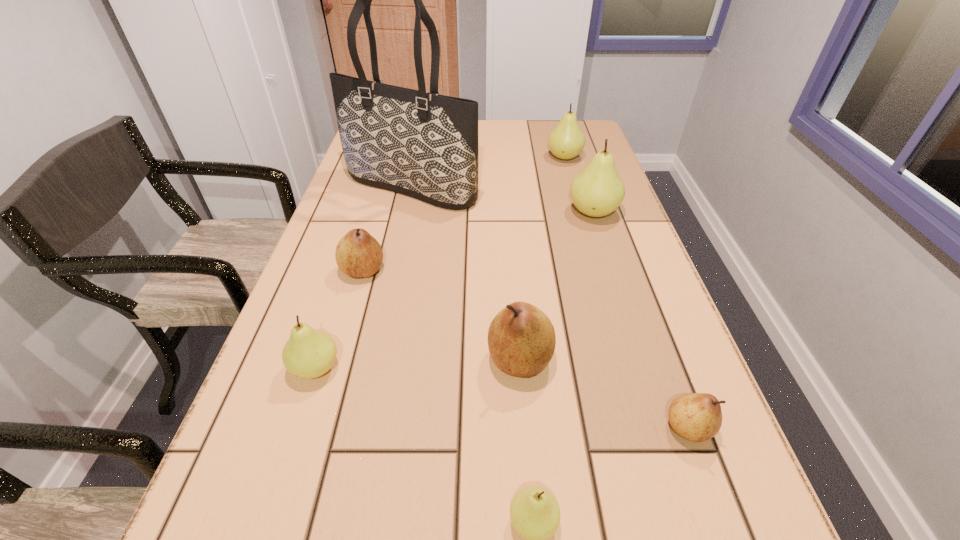
At what (x,y) coordinates should I click in order to perform the action: click on vacant region located 0.220m on the back of the sixth farthest pear. Please return your answer as a coordinate pair (x, y). Looking at the image, I should click on (645, 310).

Locate an element on the screen. The image size is (960, 540). object that is at the far edge is located at coordinates (566, 140).

At what (x,y) coordinates should I click in order to perform the action: click on tote bag that is positioned at the left edge. Please return your answer as a coordinate pair (x, y). The image size is (960, 540). Looking at the image, I should click on click(x=422, y=144).

Where is `object that is at the far right corner`? Image resolution: width=960 pixels, height=540 pixels. object that is at the far right corner is located at coordinates (566, 140).

Image resolution: width=960 pixels, height=540 pixels. What are the coordinates of `vacant space at the far edge of the desktop` in the screenshot? It's located at (485, 136).

The height and width of the screenshot is (540, 960). I want to click on vacant space at the left edge, so click(x=384, y=219).

In the image, there is a desktop. At what (x,y) coordinates should I click in order to perform the action: click on free space at the right edge. Please return your answer as a coordinate pair (x, y). The width and height of the screenshot is (960, 540). Looking at the image, I should click on tap(574, 204).

In the image, there is a desktop. Identify the location of vacant space at the far right corner. (545, 131).

Locate an element on the screen. The width and height of the screenshot is (960, 540). vacant point located between the second biggest green pear and the leftmost green pear is located at coordinates (441, 262).

Locate an element on the screen. The height and width of the screenshot is (540, 960). vacant space in between the second biggest brown pear and the third farthest green pear is located at coordinates click(340, 319).